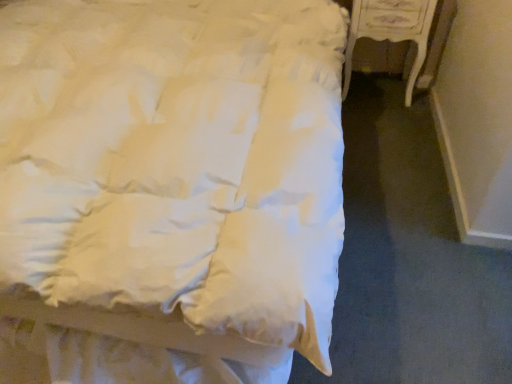
Consider the image. What is the approximate width of white satin bed at upper left?

It is 2.25 meters.

This screenshot has width=512, height=384. What do you see at coordinates (169, 189) in the screenshot?
I see `white satin bed at upper left` at bounding box center [169, 189].

Identify the location of white satin bed at upper left. Image resolution: width=512 pixels, height=384 pixels. (169, 189).

Where is `white glossy nightstand at right`? The height and width of the screenshot is (384, 512). white glossy nightstand at right is located at coordinates (401, 34).

Measure the distance between point [428,55] and camera.

Point [428,55] and camera are 8.01 feet apart from each other.

Describe the element at coordinates (401, 34) in the screenshot. I see `white glossy nightstand at right` at that location.

Find the location of a particular element. The width and height of the screenshot is (512, 384). white satin bed at upper left is located at coordinates (169, 189).

Would you say white satin bed at upper left is to the left or to the right of white glossy nightstand at right in the picture?

white satin bed at upper left is to the left of white glossy nightstand at right.

Is white satin bed at upper left in front of white glossy nightstand at right?

That is True.

Considering the positions of point (6, 283) and point (357, 3), is point (6, 283) closer or farther from the camera than point (357, 3)?

Point (6, 283) appears to be closer to the viewer than point (357, 3).

From the image's perspective, relative to white glossy nightstand at right, is white satin bed at upper left above or below?

From the image's perspective, white satin bed at upper left appears below white glossy nightstand at right.

From a real-world perspective, is white satin bed at upper left positioned under white glossy nightstand at right based on gravity?

Actually, white satin bed at upper left is physically above white glossy nightstand at right in the real world.

Between white satin bed at upper left and white glossy nightstand at right, which one has smaller width?

With smaller width is white glossy nightstand at right.

Who is taller, white satin bed at upper left or white glossy nightstand at right?

white satin bed at upper left is taller.

Who is bigger, white satin bed at upper left or white glossy nightstand at right?

Bigger between the two is white satin bed at upper left.

Would you say white satin bed at upper left is outside white glossy nightstand at right?

Yes, white satin bed at upper left is located beyond the bounds of white glossy nightstand at right.

Is white satin bed at upper left directly adjacent to white glossy nightstand at right?

No.

Is white satin bed at upper left looking in the opposite direction of white glossy nightstand at right?

No.

From the picture: How far apart are white satin bed at upper left and white glossy nightstand at right?

3.49 feet.

Where is `furniture located on the right of white satin bed at upper left`? This screenshot has height=384, width=512. furniture located on the right of white satin bed at upper left is located at coordinates (401, 34).

Considering the positions of objects white glossy nightstand at right and white satin bed at upper left in the image provided, who is more to the left, white glossy nightstand at right or white satin bed at upper left?

Positioned to the left is white satin bed at upper left.

Is the position of white glossy nightstand at right more distant than that of white satin bed at upper left?

Yes, white glossy nightstand at right is behind white satin bed at upper left.

Is point (373, 10) closer or farther from the camera than point (298, 175)?

Clearly, point (373, 10) is more distant from the camera than point (298, 175).

From the image's perspective, which is above, white glossy nightstand at right or white satin bed at upper left?

white glossy nightstand at right.

From a real-world perspective, is white glossy nightstand at right beneath white satin bed at upper left?

Yes.

Which object is thinner, white glossy nightstand at right or white satin bed at upper left?

white glossy nightstand at right is thinner.

Is white glossy nightstand at right taller than white satin bed at upper left?

No.

Considering the sizes of white glossy nightstand at right and white satin bed at upper left in the image, is white glossy nightstand at right bigger or smaller than white satin bed at upper left?

Considering their sizes, white glossy nightstand at right takes up less space than white satin bed at upper left.

Choose the correct answer: Is white glossy nightstand at right inside white satin bed at upper left or outside it?

white glossy nightstand at right cannot be found inside white satin bed at upper left.

Is white glossy nightstand at right in contact with white satin bed at upper left?

white glossy nightstand at right and white satin bed at upper left are clearly separated.

Is white glossy nightstand at right oriented away from white satin bed at upper left?

No.

How different are the orientations of white glossy nightstand at right and white satin bed at upper left in degrees?

0.883 degrees.

This screenshot has height=384, width=512. In order to click on furniture above the white satin bed at upper left (from the image's perspective) in this screenshot , I will do `click(401, 34)`.

Where is `bed below the white glossy nightstand at right (from the image's perspective)`? This screenshot has width=512, height=384. bed below the white glossy nightstand at right (from the image's perspective) is located at coordinates (169, 189).

At what (x,y) coordinates should I click in order to perform the action: click on furniture below the white satin bed at upper left (from a real-world perspective). Please return your answer as a coordinate pair (x, y). The height and width of the screenshot is (384, 512). Looking at the image, I should click on point(401,34).